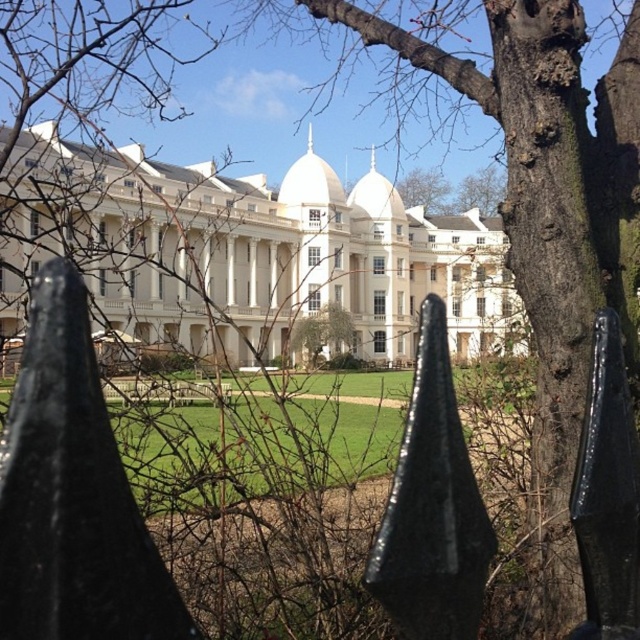
Measure the distance between black metal fence at center and camera.

The distance of black metal fence at center from camera is 48.62 meters.

From the picture: Which is more to the right, black metal fence at center or green leafy tree at center?

green leafy tree at center

Which is behind, point (113, 392) or point (438, 209)?

The point (438, 209) is more distant.

At what (x,y) coordinates should I click in order to perform the action: click on black metal fence at center. Please return your answer as a coordinate pair (x, y). Image resolution: width=640 pixels, height=640 pixels. Looking at the image, I should click on (164, 392).

Is bare branches at upper center bigger than green leafy tree at center?

Yes.

Can you confirm if bare branches at upper center is shorter than green leafy tree at center?

No.

The image size is (640, 640). I want to click on bare branches at upper center, so click(x=481, y=189).

Where is `bare branches at upper center`? The image size is (640, 640). bare branches at upper center is located at coordinates (481, 189).

From the picture: Who is lower down, white smooth palace at center or black metal fence at center?

Positioned lower is black metal fence at center.

Locate an element on the screen. The width and height of the screenshot is (640, 640). white smooth palace at center is located at coordinates (252, 256).

I want to click on white smooth palace at center, so click(x=252, y=256).